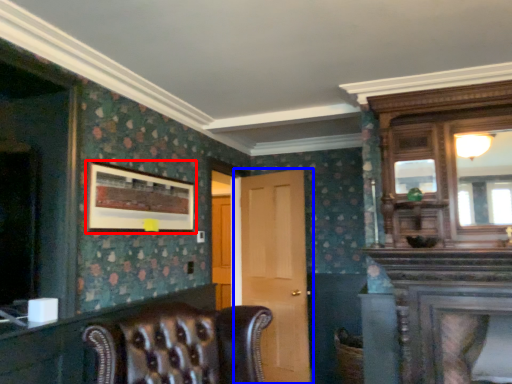
Question: Among these objects, which one is farthest to the camera, picture frame (highlighted by a red box) or door (highlighted by a blue box)?

Choices:
 (A) picture frame
 (B) door

Answer: (B)